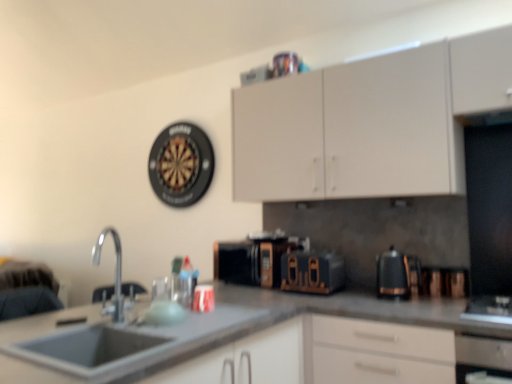
This screenshot has width=512, height=384. What do you see at coordinates (312, 272) in the screenshot?
I see `black metallic toaster at center, which appears as the first appliance when viewed from the right` at bounding box center [312, 272].

The image size is (512, 384). I want to click on gray matte sink at lower left, so click(x=104, y=343).

Describe the element at coordinates (369, 123) in the screenshot. This screenshot has height=384, width=512. I see `white matte cabinet at upper center` at that location.

Describe the element at coordinates (181, 164) in the screenshot. The image size is (512, 384). I see `black plastic dartboard at upper center` at that location.

The image size is (512, 384). I want to click on black metallic toaster at center, the 2th appliance positioned from the left, so click(312, 272).

From the picture: Considering the sizes of objects black plastic coffee pot at right and black plastic dartboard at upper center in the image provided, who is wider, black plastic coffee pot at right or black plastic dartboard at upper center?

black plastic coffee pot at right.

Locate an element on the screen. coffeepot below the black plastic dartboard at upper center (from the image's perspective) is located at coordinates (396, 275).

How distant is black plastic coffee pot at right from black plastic dartboard at upper center?

black plastic coffee pot at right and black plastic dartboard at upper center are 5.53 feet apart.

In the scene shown: Would you say black plastic dartboard at upper center is part of black plastic coffee pot at right's contents?

No, black plastic dartboard at upper center is not surrounded by black plastic coffee pot at right.

Is black plastic dartboard at upper center to the left or to the right of gray matte sink at lower left in the image?

From the image, it's evident that black plastic dartboard at upper center is to the left of gray matte sink at lower left.

Is black plastic dartboard at upper center completely or partially outside of gray matte sink at lower left?

Yes, black plastic dartboard at upper center is outside of gray matte sink at lower left.

Is there a large distance between black plastic dartboard at upper center and gray matte sink at lower left?

black plastic dartboard at upper center is far away from gray matte sink at lower left.

Can you confirm if black plastic dartboard at upper center is taller than gray matte sink at lower left?

Correct, black plastic dartboard at upper center is much taller as gray matte sink at lower left.

Considering the positions of objects smooth gray countertop at center and gray matte sink at lower left in the image provided, who is more to the left, smooth gray countertop at center or gray matte sink at lower left?

gray matte sink at lower left.

Is smooth gray countertop at center far from gray matte sink at lower left?

smooth gray countertop at center is actually quite close to gray matte sink at lower left.

How much distance is there between smooth gray countertop at center and gray matte sink at lower left?

smooth gray countertop at center and gray matte sink at lower left are 6.43 inches apart from each other.

This screenshot has width=512, height=384. Identify the location of countertop below the gray matte sink at lower left (from the image's perspective). (247, 342).

Could you tell me if black matte microwave at center, acting as the 1th appliance starting from the left, is turned towards gray matte sink at lower left?

Yes, black matte microwave at center, acting as the 1th appliance starting from the left, is aimed at gray matte sink at lower left.

How many degrees apart are the facing directions of black matte microwave at center, acting as the 1th appliance starting from the left, and gray matte sink at lower left?

92.3 degrees.

Considering the positions of objects black matte microwave at center, acting as the 1th appliance starting from the left, and gray matte sink at lower left in the image provided, who is more to the right, black matte microwave at center, acting as the 1th appliance starting from the left, or gray matte sink at lower left?

black matte microwave at center, acting as the 1th appliance starting from the left, is more to the right.

Measure the distance from black matte microwave at center, acting as the 1th appliance starting from the left, to gray matte sink at lower left.

black matte microwave at center, acting as the 1th appliance starting from the left, is 84.04 centimeters from gray matte sink at lower left.

You are a GUI agent. You are given a task and a screenshot of the screen. Output one action in this format:
    pyautogui.click(x=<x>, y=<y>)
    Task: Click on the appliance lying on the right of black matte microwave at center, acting as the 1th appliance starting from the left
    Image resolution: width=512 pixels, height=384 pixels.
    Given the screenshot: What is the action you would take?
    312,272

Is black metallic toaster at center, which appears as the first appliance when viewed from the right, directly adjacent to black matte microwave at center, which appears as the 2th appliance when viewed from the right?

They are not placed beside each other.

Does black metallic toaster at center, which appears as the first appliance when viewed from the right, turn towards black matte microwave at center, acting as the 1th appliance starting from the left?

No, black metallic toaster at center, which appears as the first appliance when viewed from the right, is not aimed at black matte microwave at center, acting as the 1th appliance starting from the left.

From the image's perspective, between black metallic toaster at center, the 2th appliance positioned from the left, and black matte microwave at center, acting as the 1th appliance starting from the left, who is located below?

black matte microwave at center, acting as the 1th appliance starting from the left, appears lower in the image.

Which point is more distant from viewer, (8, 351) or (117, 259)?

The point (117, 259) is farther.

From the image's perspective, which one is positioned higher, gray matte sink at lower left or silver metallic faucet at lower left?

From the image's view, silver metallic faucet at lower left is above.

Does gray matte sink at lower left have a smaller size compared to silver metallic faucet at lower left?

Actually, gray matte sink at lower left might be larger than silver metallic faucet at lower left.

Is gray matte sink at lower left not near silver metallic faucet at lower left?

Yes, gray matte sink at lower left and silver metallic faucet at lower left are located far from each other.

Which of these two, white matte cabinet at upper center or smooth gray countertop at center, is thinner?

white matte cabinet at upper center is thinner.

Consider the image. Is white matte cabinet at upper center turned away from smooth gray countertop at center?

No, white matte cabinet at upper center is not facing away from smooth gray countertop at center.

Would you consider white matte cabinet at upper center to be distant from smooth gray countertop at center?

No, white matte cabinet at upper center is not far away from smooth gray countertop at center.

At what (x,y) coordinates should I click in order to perform the action: click on coffeepot below the black plastic dartboard at upper center (from a real-world perspective). Please return your answer as a coordinate pair (x, y). Looking at the image, I should click on point(396,275).

This screenshot has width=512, height=384. Find the location of `sink lying on the right of black plastic dartboard at upper center`. sink lying on the right of black plastic dartboard at upper center is located at coordinates (104, 343).

Which object lies nearer to the anchor point smooth gray countertop at center, black matte microwave at center, which appears as the 2th appliance when viewed from the right, or silver metallic faucet at lower left?

black matte microwave at center, which appears as the 2th appliance when viewed from the right, lies closer to smooth gray countertop at center than the other object.

Which object lies nearer to the anchor point smooth gray countertop at center, white matte cabinet at upper center or black plastic dartboard at upper center?

Among the two, white matte cabinet at upper center is located nearer to smooth gray countertop at center.

From the picture: From the image, which object appears to be farther from smooth gray countertop at center, black metallic toaster at center, the 2th appliance positioned from the left, or gray matte sink at lower left?

black metallic toaster at center, the 2th appliance positioned from the left, is further to smooth gray countertop at center.

Considering their positions, is black metallic toaster at center, which appears as the first appliance when viewed from the right, positioned closer to black matte microwave at center, acting as the 1th appliance starting from the left, than black plastic coffee pot at right?

The object closer to black matte microwave at center, acting as the 1th appliance starting from the left, is black metallic toaster at center, which appears as the first appliance when viewed from the right.

From the image, which object appears to be farther from white matte cabinet at upper center, silver metallic faucet at lower left or black plastic dartboard at upper center?

silver metallic faucet at lower left lies further to white matte cabinet at upper center than the other object.

From the image, which object appears to be farther from gray matte sink at lower left, smooth gray countertop at center or white matte cabinet at upper center?

Among the two, white matte cabinet at upper center is located further to gray matte sink at lower left.

Which object lies further to the anchor point silver metallic faucet at lower left, black plastic coffee pot at right or black metallic toaster at center, which appears as the first appliance when viewed from the right?

Among the two, black plastic coffee pot at right is located further to silver metallic faucet at lower left.

Estimate the real-world distances between objects in this image. Which object is closer to white matte cabinet at upper center, gray matte sink at lower left or black plastic coffee pot at right?

The object closer to white matte cabinet at upper center is black plastic coffee pot at right.

Where is `cabinetry between smooth gray countertop at center and black matte microwave at center, which appears as the 2th appliance when viewed from the right, from front to back`? cabinetry between smooth gray countertop at center and black matte microwave at center, which appears as the 2th appliance when viewed from the right, from front to back is located at coordinates point(369,123).

The width and height of the screenshot is (512, 384). In order to click on cabinetry situated between gray matte sink at lower left and black plastic coffee pot at right from left to right in this screenshot , I will do `click(369, 123)`.

Where is `cabinetry between gray matte sink at lower left and black metallic toaster at center, which appears as the first appliance when viewed from the right, from front to back`? The width and height of the screenshot is (512, 384). cabinetry between gray matte sink at lower left and black metallic toaster at center, which appears as the first appliance when viewed from the right, from front to back is located at coordinates (369, 123).

Locate an element on the screen. This screenshot has width=512, height=384. tap located between gray matte sink at lower left and black matte microwave at center, which appears as the 2th appliance when viewed from the right, in the depth direction is located at coordinates point(116,274).